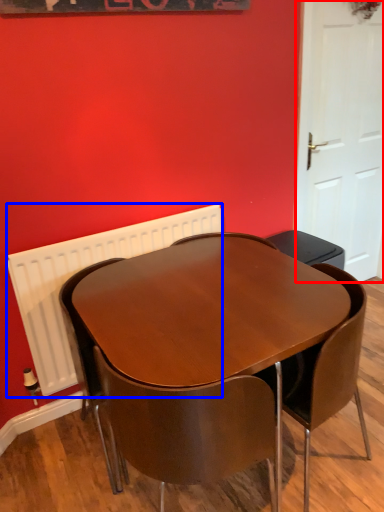
Question: Which of the following is the farthest to the observer, door (highlighted by a red box) or radiator (highlighted by a blue box)?

Choices:
 (A) door
 (B) radiator

Answer: (A)